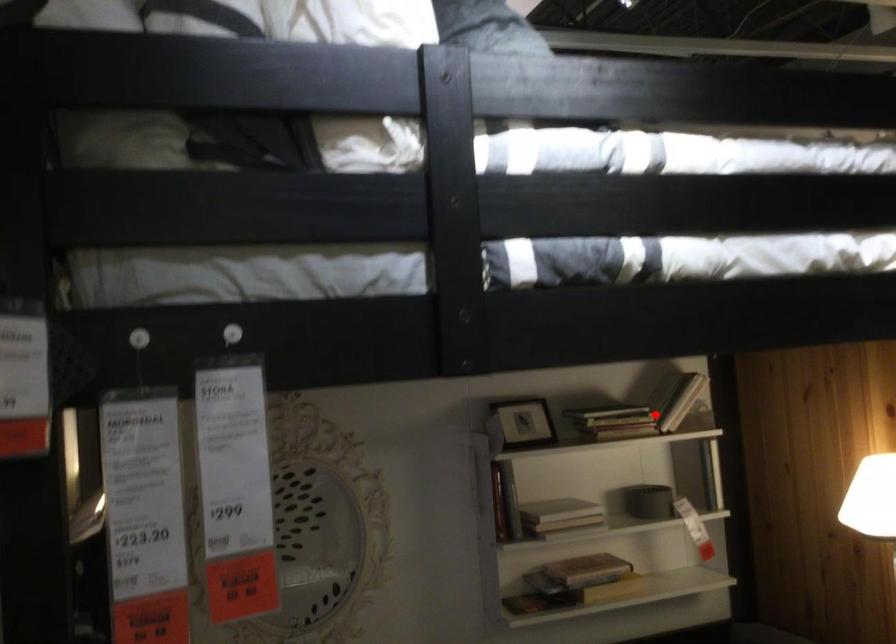
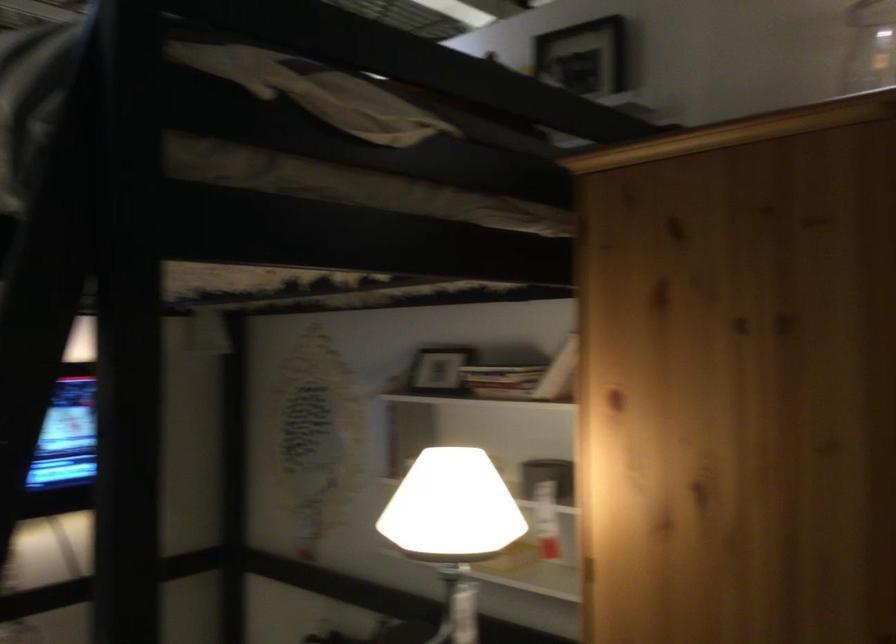
Question: I am providing you with two images of the same scene from different viewpoints. Given a red point in image1, look at the same physical point in image2. Is it:

Choices:
 (A) Closer to the viewpoint
 (B) Farther from the viewpoint

Answer: (A)